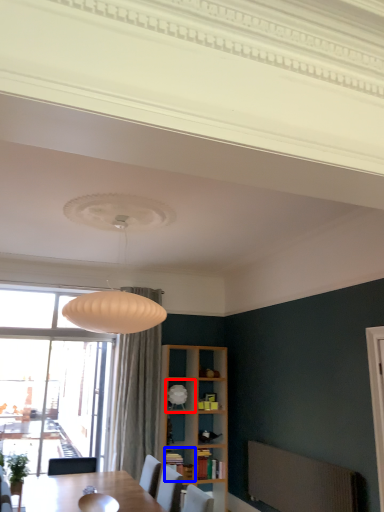
Question: Which of the following is the farthest to the observer, shelf (highlighted by a red box) or shelf (highlighted by a blue box)?

Choices:
 (A) shelf
 (B) shelf

Answer: (A)